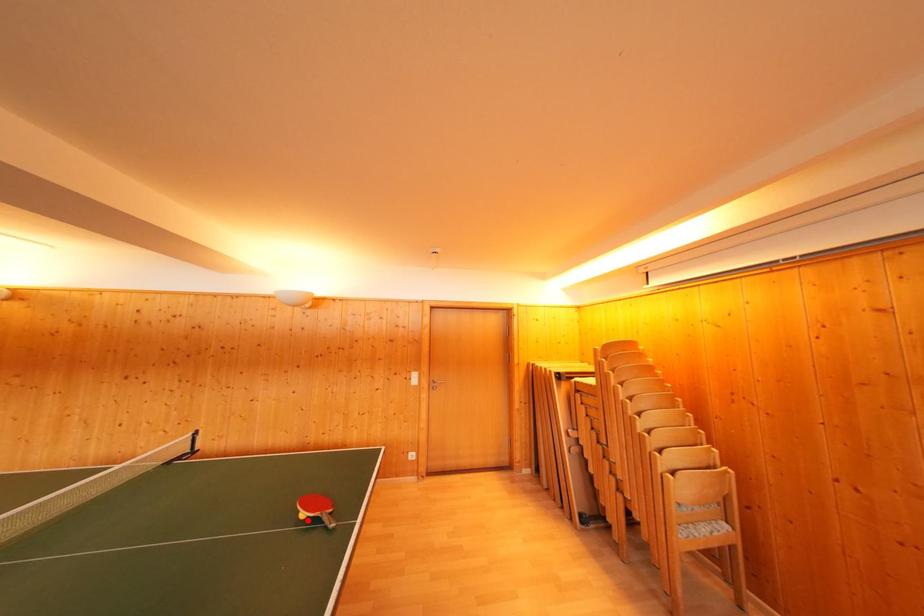
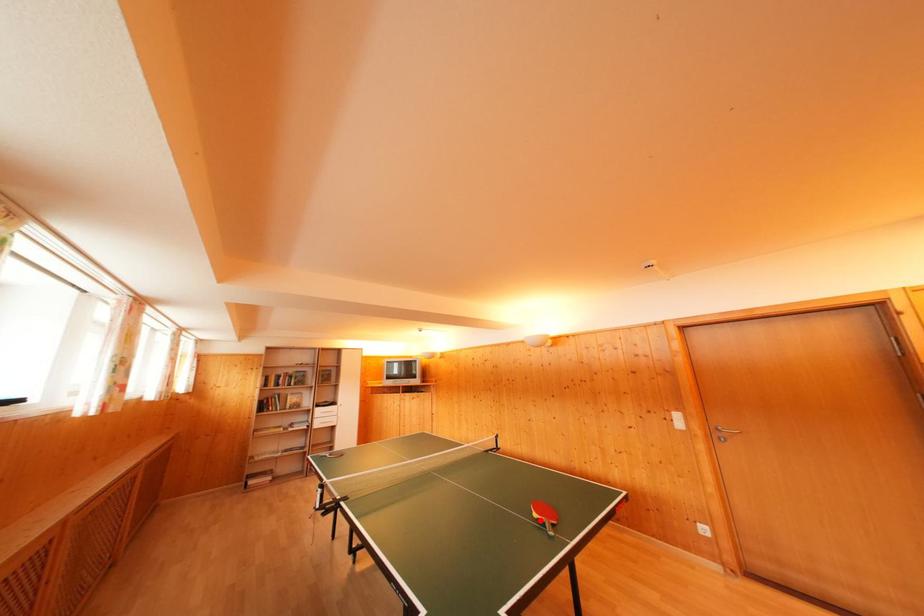
Consider the image. I am providing you with two images of the same scene from different viewpoints. A red point is marked on the first image and another point is marked on the second image. Is the red point in image1 aligned with the point shown in image2?

Yes